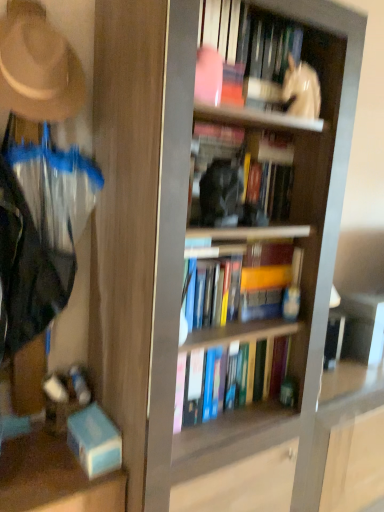
What do you see at coordinates (246, 276) in the screenshot? The image size is (384, 512). I see `hardcover books at center, arranged as the 4th book when viewed from the top` at bounding box center [246, 276].

This screenshot has height=512, width=384. What do you see at coordinates (121, 226) in the screenshot?
I see `clear plastic screen door at left` at bounding box center [121, 226].

Locate an element on the screen. This screenshot has height=512, width=384. hardcover book at center, arranged as the 2th book when viewed from the top is located at coordinates (268, 190).

From the image's perspective, which one is positioned higher, beige felt hat at upper left or hardcover books at center, arranged as the 4th book when viewed from the top?

From the image's view, beige felt hat at upper left is above.

Can you confirm if beige felt hat at upper left is smaller than hardcover books at center, arranged as the 4th book when viewed from the top?

Incorrect, beige felt hat at upper left is not smaller in size than hardcover books at center, arranged as the 4th book when viewed from the top.

Which is in front, beige felt hat at upper left or hardcover books at center, the first book when ordered from bottom to top?

beige felt hat at upper left is closer to the camera.

Is beige felt hat at upper left to the left or to the right of hardcover books at center, the first book when ordered from bottom to top, in the image?

beige felt hat at upper left is to the left of hardcover books at center, the first book when ordered from bottom to top.

From the image's perspective, is hardcover book at center, arranged as the 2th book when viewed from the top, located above or below hardcover book at center, acting as the second book starting from the bottom?

Clearly, from the image's perspective, hardcover book at center, arranged as the 2th book when viewed from the top, is above hardcover book at center, acting as the second book starting from the bottom.

How much distance is there between hardcover book at center, arranged as the 2th book when viewed from the top, and hardcover book at center, acting as the second book starting from the bottom?

They are 6.39 centimeters apart.

Is hardcover book at center, arranged as the 2th book when viewed from the top, looking in the opposite direction of hardcover book at center, which is the 3th book in top-to-bottom order?

No, hardcover book at center, arranged as the 2th book when viewed from the top, is not facing away from hardcover book at center, which is the 3th book in top-to-bottom order.

Can you confirm if hardcover book at center, the third book when ordered from bottom to top, is positioned to the right of hardcover book at center, which is the 3th book in top-to-bottom order?

Yes, hardcover book at center, the third book when ordered from bottom to top, is to the right of hardcover book at center, which is the 3th book in top-to-bottom order.

The image size is (384, 512). Find the location of `hat that is below the white glossy statue at upper center (from the image's perspective)`. hat that is below the white glossy statue at upper center (from the image's perspective) is located at coordinates (38, 67).

From the picture: Between beige felt hat at upper left and white glossy statue at upper center, which one has larger size?

beige felt hat at upper left.

How far apart are beige felt hat at upper left and white glossy statue at upper center?

A distance of 69.51 centimeters exists between beige felt hat at upper left and white glossy statue at upper center.

Is white glossy statue at upper center, which ranks as the 4th book in bottom-to-top order, facing towards hardcover book at center, which is the 3th book in top-to-bottom order?

No, white glossy statue at upper center, which ranks as the 4th book in bottom-to-top order, does not turn towards hardcover book at center, which is the 3th book in top-to-bottom order.

In the scene shown: Is hardcover book at center, which is the 3th book in top-to-bottom order, inside white glossy statue at upper center, which ranks as the 4th book in bottom-to-top order?

No, white glossy statue at upper center, which ranks as the 4th book in bottom-to-top order, does not contain hardcover book at center, which is the 3th book in top-to-bottom order.

Between white glossy statue at upper center, which ranks as the 4th book in bottom-to-top order, and hardcover book at center, which is the 3th book in top-to-bottom order, which one is positioned in front?

Positioned in front is hardcover book at center, which is the 3th book in top-to-bottom order.

Considering the sizes of objects white glossy statue at upper center, which ranks as the first book in top-to-bottom order, and hardcover book at center, acting as the second book starting from the bottom, in the image provided, who is bigger, white glossy statue at upper center, which ranks as the first book in top-to-bottom order, or hardcover book at center, acting as the second book starting from the bottom,?

With larger size is white glossy statue at upper center, which ranks as the first book in top-to-bottom order.

In the scene shown: Considering the positions of objects hardcover books at center, arranged as the 4th book when viewed from the top, and beige felt hat at upper left in the image provided, who is more to the left, hardcover books at center, arranged as the 4th book when viewed from the top, or beige felt hat at upper left?

From the viewer's perspective, beige felt hat at upper left appears more on the left side.

Considering the sizes of objects hardcover books at center, arranged as the 4th book when viewed from the top, and beige felt hat at upper left in the image provided, who is taller, hardcover books at center, arranged as the 4th book when viewed from the top, or beige felt hat at upper left?

With more height is beige felt hat at upper left.

Between hardcover books at center, arranged as the 4th book when viewed from the top, and beige felt hat at upper left, which one has smaller width?

beige felt hat at upper left.

Is beige felt hat at upper left at the back of hardcover books at center, the first book when ordered from bottom to top?

That's not correct — hardcover books at center, the first book when ordered from bottom to top, is not looking away from beige felt hat at upper left.

From a real-world perspective, is beige felt hat at upper left positioned under clear plastic screen door at left based on gravity?

No, from a real-world perspective, beige felt hat at upper left is not below clear plastic screen door at left.

Is beige felt hat at upper left smaller than clear plastic screen door at left?

Yes, beige felt hat at upper left is smaller than clear plastic screen door at left.

Between point (42, 25) and point (121, 230), which one is positioned in front?

Positioned in front is point (42, 25).

Is the depth of beige felt hat at upper left greater than that of clear plastic screen door at left?

Yes, beige felt hat at upper left is further from the camera.

From a real-world perspective, is clear plastic screen door at left positioned under hardcover books at center, the first book when ordered from bottom to top, based on gravity?

No, from a real-world perspective, clear plastic screen door at left is not under hardcover books at center, the first book when ordered from bottom to top.

Based on the photo, considering the sizes of clear plastic screen door at left and hardcover books at center, arranged as the 4th book when viewed from the top, in the image, is clear plastic screen door at left wider or thinner than hardcover books at center, arranged as the 4th book when viewed from the top,?

Clearly, clear plastic screen door at left has more width compared to hardcover books at center, arranged as the 4th book when viewed from the top.

Can you tell me how much clear plastic screen door at left and hardcover books at center, arranged as the 4th book when viewed from the top, differ in facing direction?

clear plastic screen door at left and hardcover books at center, arranged as the 4th book when viewed from the top, are facing 0.742 degrees away from each other.

Would you say clear plastic screen door at left is a long distance from hardcover books at center, the first book when ordered from bottom to top?

No, there isn't a large distance between clear plastic screen door at left and hardcover books at center, the first book when ordered from bottom to top.

In the image, there is a hardcover books at center, arranged as the 4th book when viewed from the top. What are the coordinates of `hat above it (from the image's perspective)` in the screenshot? It's located at (38, 67).

Where is `the 2nd book to the right of the hardcover book at center, which is the 3th book in top-to-bottom order, starting your count from the anchor`? Image resolution: width=384 pixels, height=512 pixels. the 2nd book to the right of the hardcover book at center, which is the 3th book in top-to-bottom order, starting your count from the anchor is located at coordinates (268, 190).

Looking at the image, which one is located closer to hardcover book at center, which is the 3th book in top-to-bottom order, hardcover book at center, the third book when ordered from bottom to top, or white glossy statue at upper center?

hardcover book at center, the third book when ordered from bottom to top.

Estimate the real-world distances between objects in this image. Which object is further from hardcover books at center, arranged as the 4th book when viewed from the top, hardcover book at center, which is the 3th book in top-to-bottom order, or beige felt hat at upper left?

Among the two, beige felt hat at upper left is located further to hardcover books at center, arranged as the 4th book when viewed from the top.

Which object lies further to the anchor point white glossy statue at upper center, which ranks as the first book in top-to-bottom order, hardcover books at center, arranged as the 4th book when viewed from the top, or clear plastic screen door at left?

hardcover books at center, arranged as the 4th book when viewed from the top, lies further to white glossy statue at upper center, which ranks as the first book in top-to-bottom order, than the other object.

Which object lies further to the anchor point clear plastic screen door at left, beige felt hat at upper left or white glossy statue at upper center, which ranks as the first book in top-to-bottom order?

white glossy statue at upper center, which ranks as the first book in top-to-bottom order.

Based on their spatial positions, is hardcover books at center, arranged as the 4th book when viewed from the top, or hardcover book at center, arranged as the 2th book when viewed from the top, further from white glossy statue at upper center?

The object further to white glossy statue at upper center is hardcover books at center, arranged as the 4th book when viewed from the top.

Considering their positions, is hardcover book at center, acting as the second book starting from the bottom, positioned further to white glossy statue at upper center than hardcover books at center, the first book when ordered from bottom to top?

hardcover books at center, the first book when ordered from bottom to top, is further to white glossy statue at upper center.

Which object lies further to the anchor point white glossy statue at upper center, hardcover book at center, acting as the second book starting from the bottom, or white glossy statue at upper center, which ranks as the 4th book in bottom-to-top order?

hardcover book at center, acting as the second book starting from the bottom, is further to white glossy statue at upper center.

Which object lies nearer to the anchor point hardcover books at center, the first book when ordered from bottom to top, beige felt hat at upper left or hardcover book at center, the third book when ordered from bottom to top?

hardcover book at center, the third book when ordered from bottom to top.

This screenshot has height=512, width=384. I want to click on book between beige felt hat at upper left and hardcover books at center, the first book when ordered from bottom to top, in the horizontal direction, so point(236,173).

Image resolution: width=384 pixels, height=512 pixels. Identify the location of person between white glossy statue at upper center, which ranks as the first book in top-to-bottom order, and hardcover book at center, the third book when ordered from bottom to top, in the up-down direction. (301, 90).

Where is `screen door between beige felt hat at upper left and hardcover book at center, acting as the second book starting from the bottom, in the horizontal direction`? screen door between beige felt hat at upper left and hardcover book at center, acting as the second book starting from the bottom, in the horizontal direction is located at coordinates (121, 226).

The height and width of the screenshot is (512, 384). Identify the location of person between white glossy statue at upper center, which ranks as the 4th book in bottom-to-top order, and hardcover book at center, acting as the second book starting from the bottom, in the up-down direction. (301, 90).